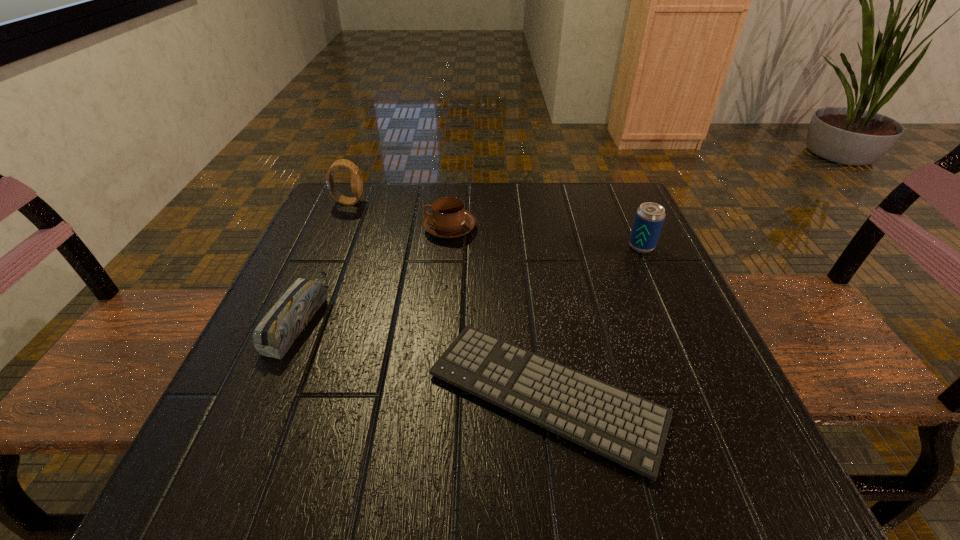
This screenshot has height=540, width=960. I want to click on free space that satisfies the following two spatial constraints: 1. on the back side of the pencil box; 2. on the left side of the rightmost object, so click(x=329, y=246).

Image resolution: width=960 pixels, height=540 pixels. Find the location of `vacant space that satisfies the following two spatial constraints: 1. on the face of the watch; 2. on the back side of the beer can`. vacant space that satisfies the following two spatial constraints: 1. on the face of the watch; 2. on the back side of the beer can is located at coordinates (329, 246).

This screenshot has width=960, height=540. I want to click on blank space that satisfies the following two spatial constraints: 1. on the face of the watch; 2. on the back side of the computer keyboard, so click(266, 394).

Locate an element on the screen. This screenshot has width=960, height=540. vacant region that satisfies the following two spatial constraints: 1. on the side of the cappuccino with the handle; 2. on the back side of the shortest object is located at coordinates (435, 394).

You are a GUI agent. You are given a task and a screenshot of the screen. Output one action in this format:
    pyautogui.click(x=<x>, y=<y>)
    Task: Click on the free space in the image that satisfies the following two spatial constraints: 1. on the face of the beer can; 2. on the left side of the watch
    The height and width of the screenshot is (540, 960).
    Given the screenshot: What is the action you would take?
    pyautogui.click(x=329, y=246)